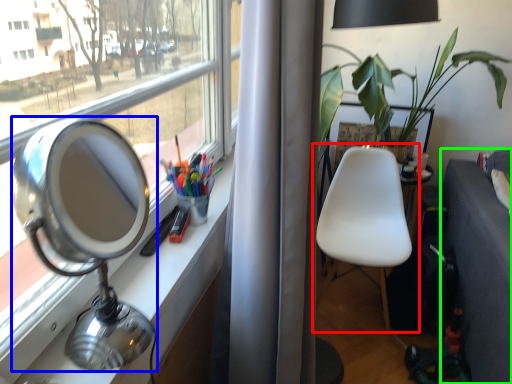
Question: Which object is the closest to the chair (highlighted by a red box)? Choose among these: table lamp (highlighted by a blue box) or studio couch (highlighted by a green box).

Choices:
 (A) table lamp
 (B) studio couch

Answer: (B)